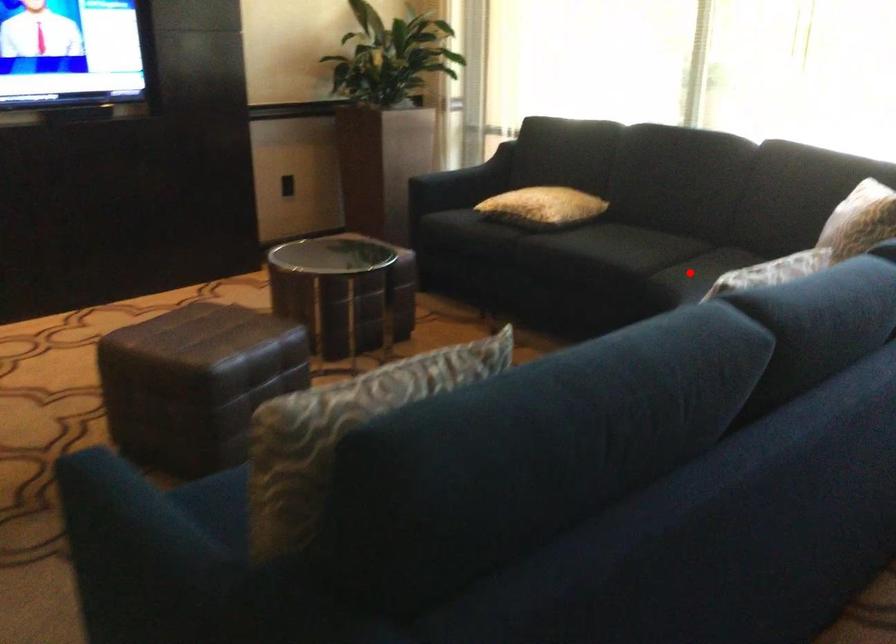
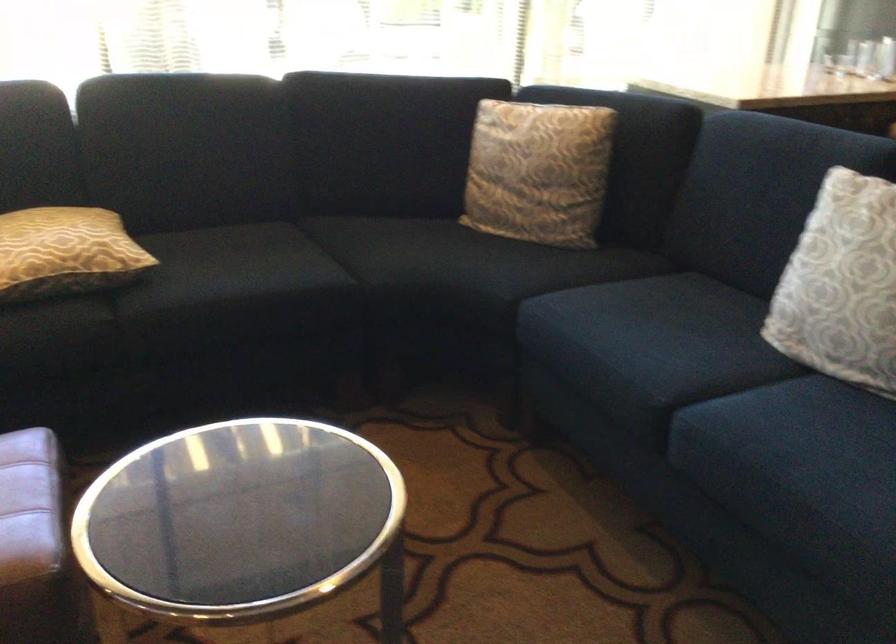
Question: I am providing you with two images of the same scene from different viewpoints. In image1, a red point is highlighted. Considering the same 3D point in image2, which of the following is correct?

Choices:
 (A) It is closer
 (B) It is farther

Answer: (A)